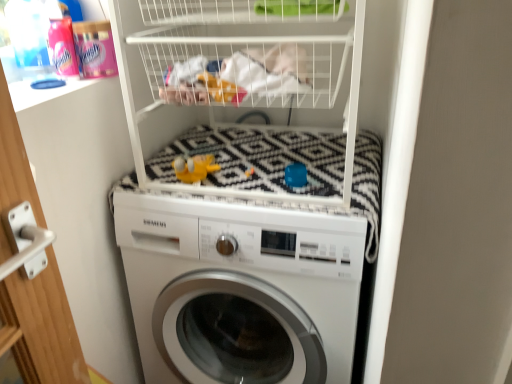
Question: From the image's perspective, is yellow rubber duck at center beneath white glossy washing machine at center?

Choices:
 (A) yes
 (B) no

Answer: (B)

Question: Is yellow rubber duck at center shorter than white glossy washing machine at center?

Choices:
 (A) no
 (B) yes

Answer: (B)

Question: Is yellow rubber duck at center beside white glossy washing machine at center?

Choices:
 (A) yes
 (B) no

Answer: (B)

Question: Is white glossy washing machine at center completely or partially inside yellow rubber duck at center?

Choices:
 (A) yes
 (B) no

Answer: (B)

Question: Is yellow rubber duck at center at the left side of white glossy washing machine at center?

Choices:
 (A) no
 (B) yes

Answer: (B)

Question: Does yellow rubber duck at center come in front of white glossy washing machine at center?

Choices:
 (A) yes
 (B) no

Answer: (B)

Question: Considering the relative positions of white glossy washing machine at center and yellow rubber duck at center in the image provided, is white glossy washing machine at center to the right of yellow rubber duck at center from the viewer's perspective?

Choices:
 (A) yes
 (B) no

Answer: (A)

Question: Does white glossy washing machine at center have a lesser width compared to yellow rubber duck at center?

Choices:
 (A) no
 (B) yes

Answer: (A)

Question: Could you tell me if white glossy washing machine at center is turned towards yellow rubber duck at center?

Choices:
 (A) no
 (B) yes

Answer: (A)

Question: From the image's perspective, is white glossy washing machine at center above yellow rubber duck at center?

Choices:
 (A) no
 (B) yes

Answer: (A)

Question: From the image's perspective, is white glossy washing machine at center below yellow rubber duck at center?

Choices:
 (A) yes
 (B) no

Answer: (A)

Question: Does white glossy washing machine at center have a greater height compared to yellow rubber duck at center?

Choices:
 (A) yes
 (B) no

Answer: (A)

Question: Is white glossy washing machine at center to the left or to the right of yellow rubber duck at center in the image?

Choices:
 (A) left
 (B) right

Answer: (B)